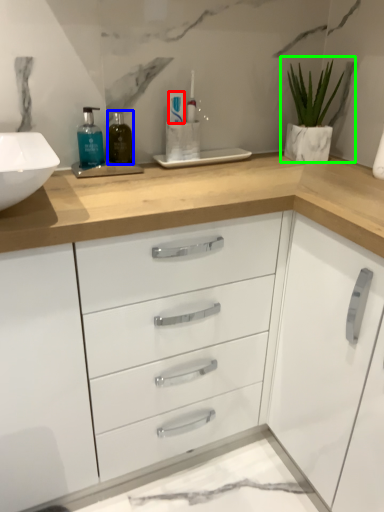
Question: Which is nearer to the toothpaste (highlighted by a red box)? mouthwash (highlighted by a blue box) or houseplant (highlighted by a green box).

Choices:
 (A) mouthwash
 (B) houseplant

Answer: (A)